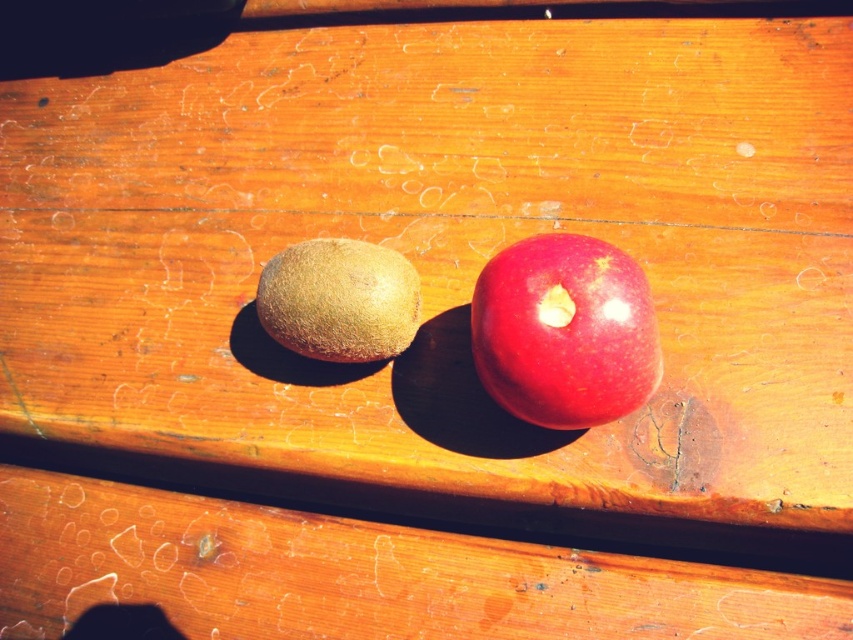
You are a fruit vendor arranging fruits on a wooden table. You need to place a new fruit basket behind the glossy red apple at center so that it is still visible from your current position. Can you do this without moving the brown fuzzy kiwi at center?

The glossy red apple at center is in front of the brown fuzzy kiwi at center. Since the apple is already blocking the view of the kiwi, placing the basket behind the apple would place it further back, so the basket would be behind both the apple and the kiwi. However, since the apple is in front, the basket can be placed behind it while still keeping the apple visible. The brown fuzzy kiwi at center doesn not need to be moved because the basket will be behind the apple, which is already in front of the kiwi

You are arranging fruits on a wooden table and need to place a glossy red apple at center and a brown fuzzy kiwi at center. Based on the image, which fruit should you place first to ensure proper positioning?

The brown fuzzy kiwi at center should be placed first because the glossy red apple at center is to the right of it, meaning the kiwi needs to be positioned to the left of the apple to maintain their correct spatial relationship.